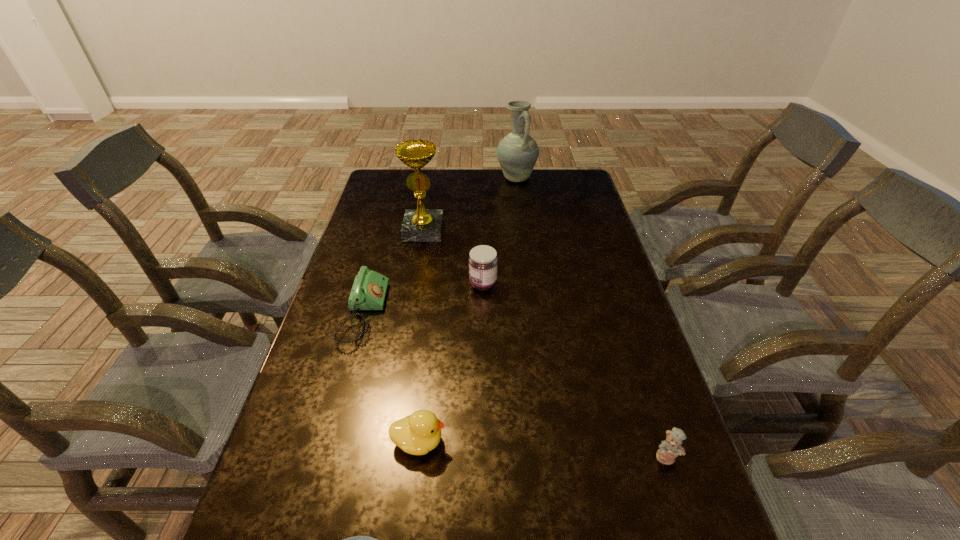
Where is `vacant space at the left edge of the desktop`? vacant space at the left edge of the desktop is located at coordinates (332, 479).

At what (x,y) coordinates should I click in order to perform the action: click on vacant space at the right edge of the desktop. Please return your answer as a coordinate pair (x, y). Looking at the image, I should click on (594, 214).

Locate an element on the screen. This screenshot has width=960, height=540. vacant space at the far right corner of the desktop is located at coordinates (559, 194).

Identify the location of unoccupied position between the duckling and the pitcher. (468, 310).

Where is `free spot between the duckling and the fifth object from left to right`? The width and height of the screenshot is (960, 540). free spot between the duckling and the fifth object from left to right is located at coordinates (451, 363).

This screenshot has width=960, height=540. Find the location of `free spot between the duckling and the telephone`. free spot between the duckling and the telephone is located at coordinates (392, 377).

Image resolution: width=960 pixels, height=540 pixels. What are the coordinates of `free spot between the telephone and the third tallest object` in the screenshot? It's located at (423, 299).

You are a GUI agent. You are given a task and a screenshot of the screen. Output one action in this format:
    pyautogui.click(x=<x>, y=<y>)
    Task: Click on the blank region between the farthest object and the second farthest object
    Image resolution: width=960 pixels, height=540 pixels.
    Given the screenshot: What is the action you would take?
    (469, 204)

Find the location of `unoccupied area between the sixth nearest object and the sixth object from left to right`. unoccupied area between the sixth nearest object and the sixth object from left to right is located at coordinates (469, 204).

The image size is (960, 540). Identify the location of empty space that is in between the third object from right to left and the telephone. (423, 299).